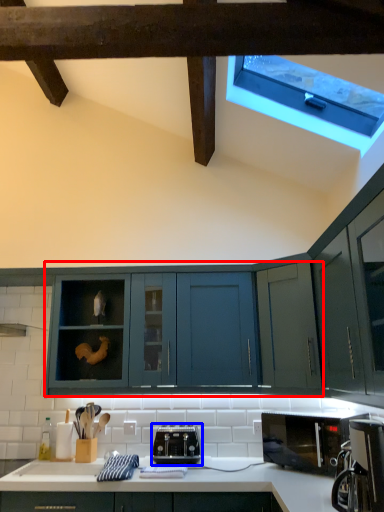
Question: Which point is closer to the camera, cabinetry (highlighted by a red box) or toaster (highlighted by a blue box)?

Choices:
 (A) cabinetry
 (B) toaster

Answer: (B)